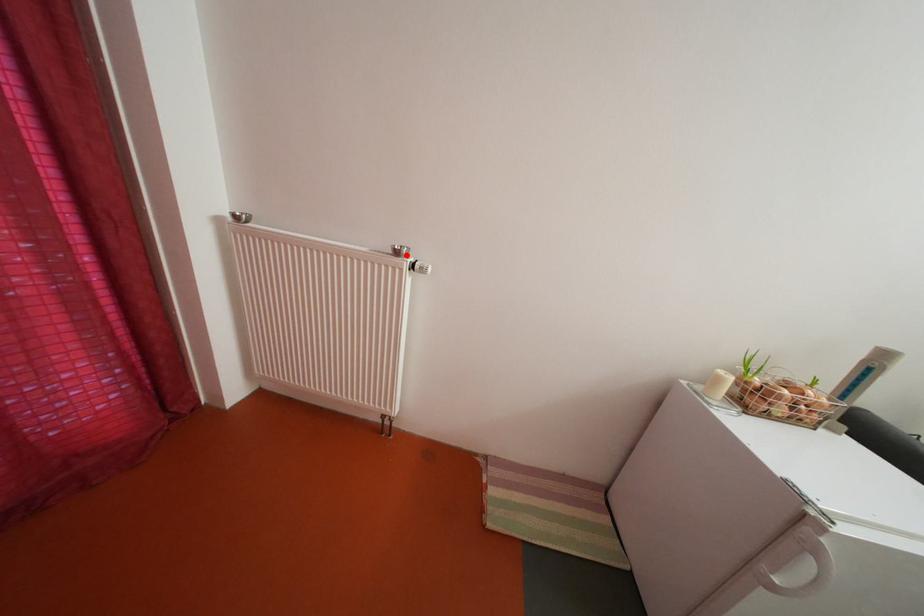
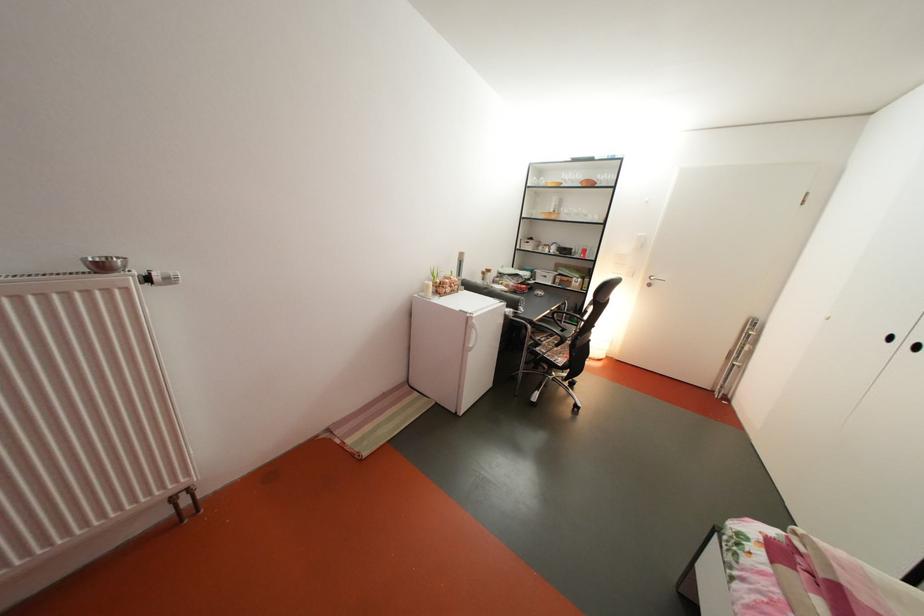
Where in the second image is the point corresponding to the highlighted location from the first image?

(107, 270)